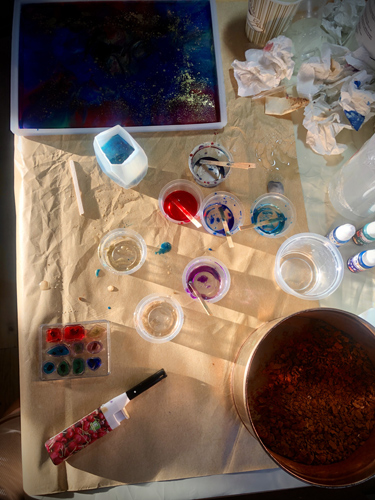
Image resolution: width=375 pixels, height=500 pixels. I want to click on cup, so click(x=281, y=19).